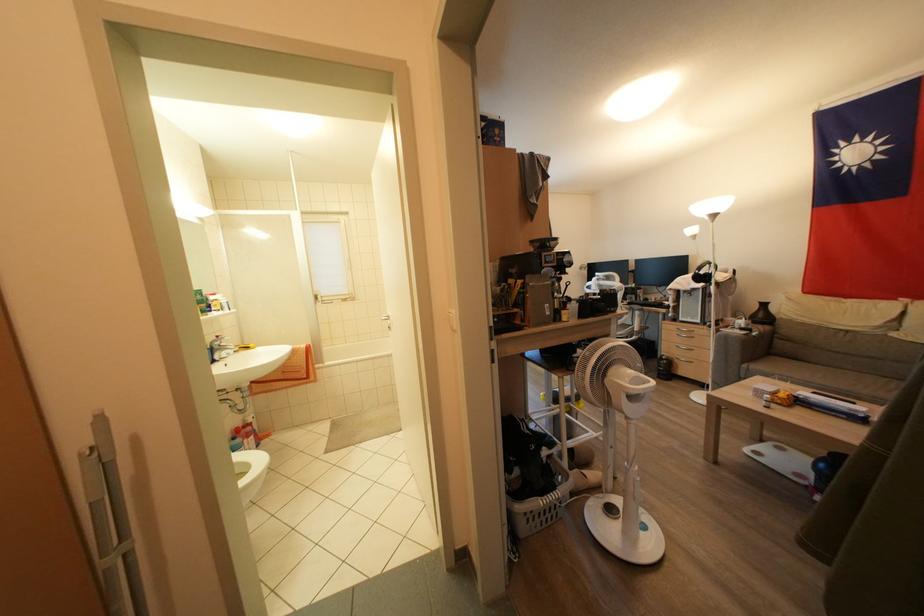
What do you see at coordinates (733, 339) in the screenshot? The width and height of the screenshot is (924, 616). I see `the chair armrest` at bounding box center [733, 339].